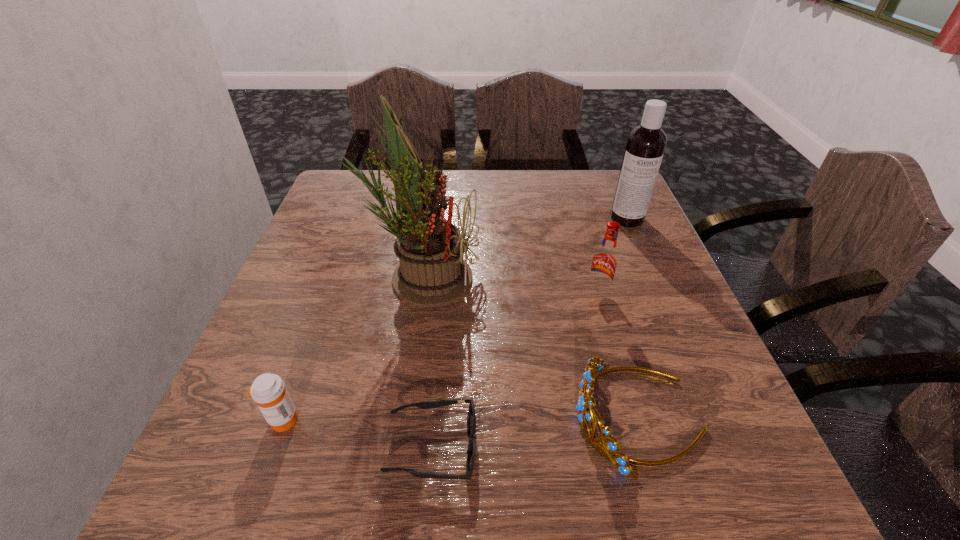
Where is `flower arrangement`? flower arrangement is located at coordinates (432, 272).

At what (x,y) coordinates should I click in order to perform the action: click on the farthest object. Please return your answer as a coordinate pair (x, y). Image resolution: width=960 pixels, height=540 pixels. Looking at the image, I should click on (646, 143).

This screenshot has height=540, width=960. Find the location of `dishwasher detergent`. dishwasher detergent is located at coordinates (646, 143).

Where is `root beer`? The height and width of the screenshot is (540, 960). root beer is located at coordinates (604, 263).

Find the location of `tiara`. tiara is located at coordinates (610, 449).

In order to click on medicine in this screenshot , I will do `click(268, 390)`.

Where is `the fifth tallest object`? This screenshot has height=540, width=960. the fifth tallest object is located at coordinates (268, 390).

Locate an element on the screen. the shortest object is located at coordinates (471, 417).

The height and width of the screenshot is (540, 960). In order to click on vacant space situated in front of the tallest object with the fan visible in this screenshot , I will do `click(548, 277)`.

At what (x,y) coordinates should I click in order to perform the action: click on vacant area located 0.360m on the label side of the farthest object. Please return your answer as a coordinate pair (x, y). The width and height of the screenshot is (960, 540). Looking at the image, I should click on (679, 340).